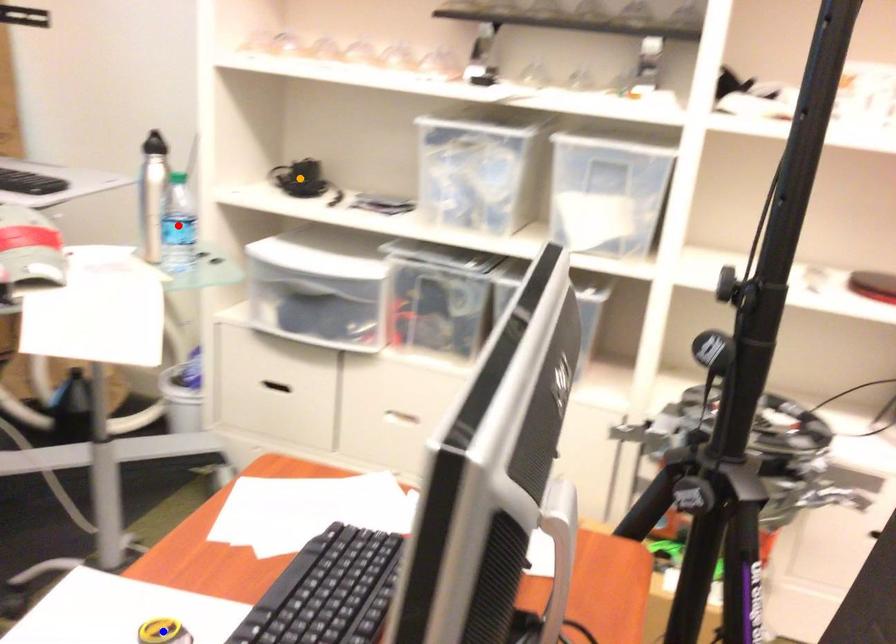
Order these from nearest to farthest:
orange point, red point, blue point

blue point, red point, orange point